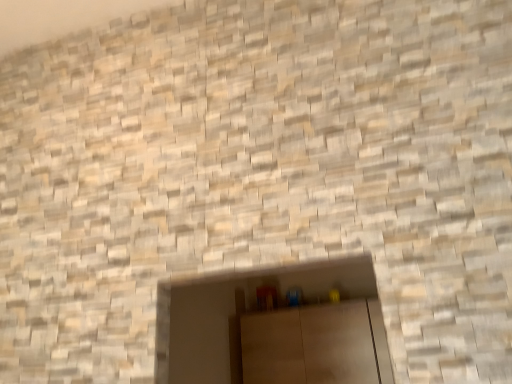
At what (x,y) coordinates should I click in order to perform the action: click on matte brown cabinet at lower center. Please return your answer as a coordinate pair (x, y). This screenshot has height=384, width=512. Looking at the image, I should click on (315, 345).

Measure the distance between point [289,328] and camera.

They are 8.26 feet apart.

The height and width of the screenshot is (384, 512). Describe the element at coordinates (315, 345) in the screenshot. I see `matte brown cabinet at lower center` at that location.

Where is `matte brown cabinet at lower center`? Image resolution: width=512 pixels, height=384 pixels. matte brown cabinet at lower center is located at coordinates click(315, 345).